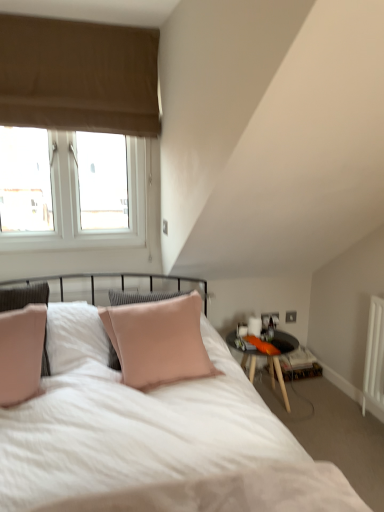
I want to click on beige fabric window at upper left, so click(x=78, y=76).

In order to face beige fabric window at upper left, should I rotate leftwards or rightwards?

A 16.135 degree turn to the left will do.

Describe the element at coordinates (78, 76) in the screenshot. I see `beige fabric window at upper left` at that location.

Measure the distance between point (83, 76) and camera.

They are 2.47 meters apart.

Identify the location of black glass table at right. Image resolution: width=384 pixels, height=512 pixels. (273, 361).

What do you see at coordinates (273, 361) in the screenshot? The image size is (384, 512). I see `black glass table at right` at bounding box center [273, 361].

Locate an element on the screen. The width and height of the screenshot is (384, 512). beige fabric window at upper left is located at coordinates (78, 76).

Visually, is black glass table at right positioned to the left or to the right of beige fabric window at upper left?

Clearly, black glass table at right is on the right of beige fabric window at upper left in the image.

Between black glass table at right and beige fabric window at upper left, which one is positioned in front?

beige fabric window at upper left is more forward.

Considering the positions of point (272, 361) and point (50, 86), is point (272, 361) closer or farther from the camera than point (50, 86)?

Clearly, point (272, 361) is more distant from the camera than point (50, 86).

From the image's perspective, is black glass table at right located above or below beige fabric window at upper left?

black glass table at right is below beige fabric window at upper left.

From a real-world perspective, is black glass table at right above or below beige fabric window at upper left?

black glass table at right is below beige fabric window at upper left.

In terms of width, does black glass table at right look wider or thinner when compared to beige fabric window at upper left?

In the image, black glass table at right appears to be wider than beige fabric window at upper left.

Who is taller, black glass table at right or beige fabric window at upper left?

Standing taller between the two is beige fabric window at upper left.

Considering the sizes of objects black glass table at right and beige fabric window at upper left in the image provided, who is smaller, black glass table at right or beige fabric window at upper left?

black glass table at right is smaller.

Is black glass table at right spatially inside beige fabric window at upper left, or outside of it?

black glass table at right lies outside beige fabric window at upper left.

Does black glass table at right touch beige fabric window at upper left?

No, black glass table at right is not beside beige fabric window at upper left.

Is black glass table at right facing towards beige fabric window at upper left?

No, black glass table at right is not oriented towards beige fabric window at upper left.

What's the angular difference between black glass table at right and beige fabric window at upper left's facing directions?

There is a 0.741-degree angle between the facing directions of black glass table at right and beige fabric window at upper left.

What are the coordinates of `window positioned vertically above the black glass table at right (from a real-world perspective)` in the screenshot? It's located at (78, 76).

Considering the relative positions of beige fabric window at upper left and black glass table at right in the image provided, is beige fabric window at upper left to the right of black glass table at right from the viewer's perspective?

Incorrect, beige fabric window at upper left is not on the right side of black glass table at right.

Considering the positions of objects beige fabric window at upper left and black glass table at right in the image provided, who is behind, beige fabric window at upper left or black glass table at right?

black glass table at right is further away from the camera.

Considering the positions of points (123, 42) and (279, 364), is point (123, 42) farther from camera compared to point (279, 364)?

No, it is not.

From the image's perspective, is beige fabric window at upper left located above black glass table at right?

Yes, from the image's perspective, beige fabric window at upper left is above black glass table at right.

Looking at this image, from a real-world perspective, does beige fabric window at upper left stand above black glass table at right?

Yes, from a real-world perspective, beige fabric window at upper left is over black glass table at right

In terms of width, does beige fabric window at upper left look wider or thinner when compared to black glass table at right?

In the image, beige fabric window at upper left appears to be more narrow than black glass table at right.

Is beige fabric window at upper left taller than black glass table at right?

Correct, beige fabric window at upper left is much taller as black glass table at right.

Between beige fabric window at upper left and black glass table at right, which one has smaller size?

Smaller between the two is black glass table at right.

From the picture: Would you say beige fabric window at upper left is outside black glass table at right?

Indeed, beige fabric window at upper left is completely outside black glass table at right.

Is beige fabric window at upper left placed right next to black glass table at right?

beige fabric window at upper left is not next to black glass table at right, and they're not touching.

Is beige fabric window at upper left aimed at black glass table at right?

No, beige fabric window at upper left is not oriented towards black glass table at right.

How far apart are beige fabric window at upper left and black glass table at right?

beige fabric window at upper left and black glass table at right are 1.92 meters apart.

Locate an element on the screen. The image size is (384, 512). table that is below the beige fabric window at upper left (from the image's perspective) is located at coordinates (273, 361).

Identify the location of table that is below the beige fabric window at upper left (from the image's perspective). pyautogui.click(x=273, y=361).

This screenshot has width=384, height=512. In order to click on table behind the beige fabric window at upper left in this screenshot , I will do `click(273, 361)`.